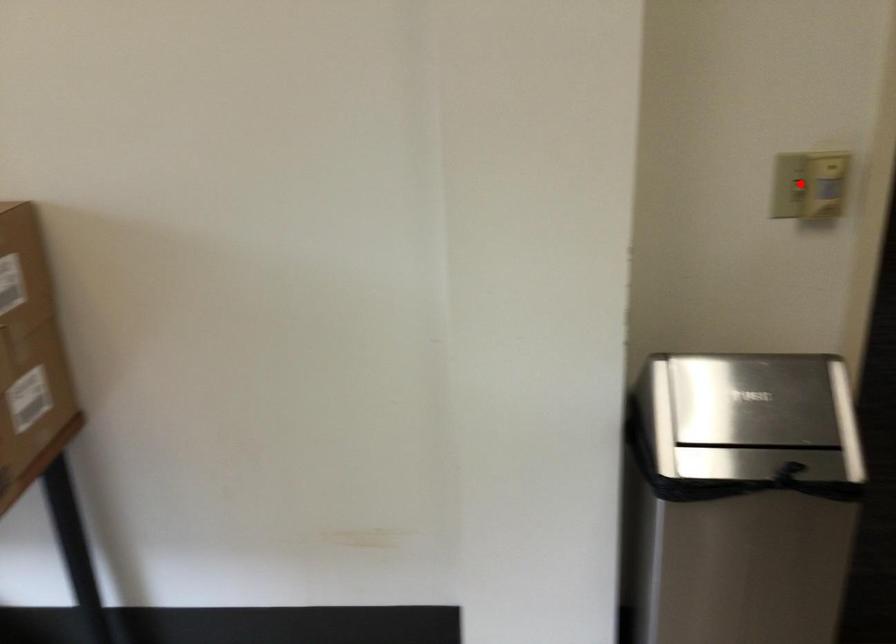
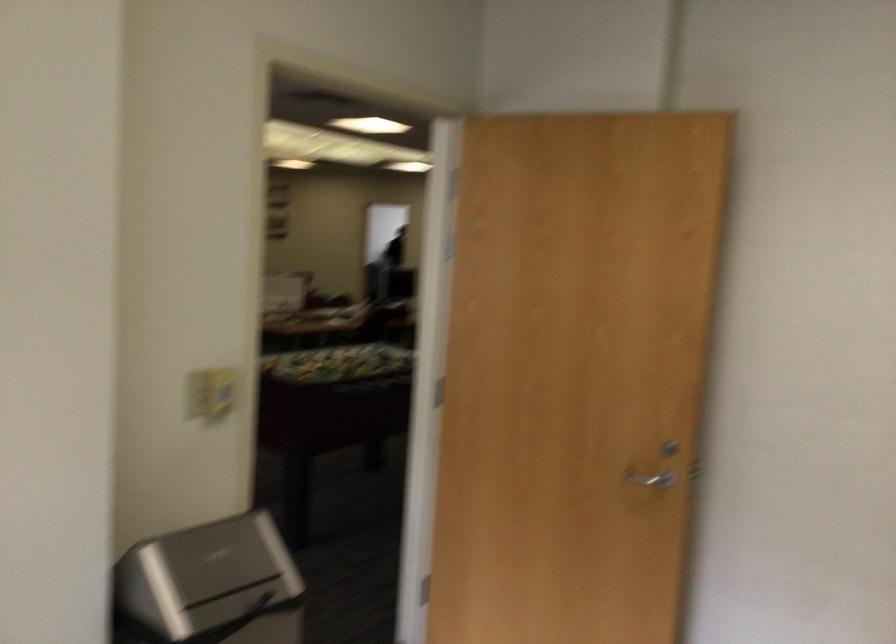
Question: I am providing you with two images of the same scene from different viewpoints. A red point is shown in image1. For the corresponding object point in image2, is it positioned nearer or farther from the camera?

Choices:
 (A) Nearer
 (B) Farther

Answer: (B)